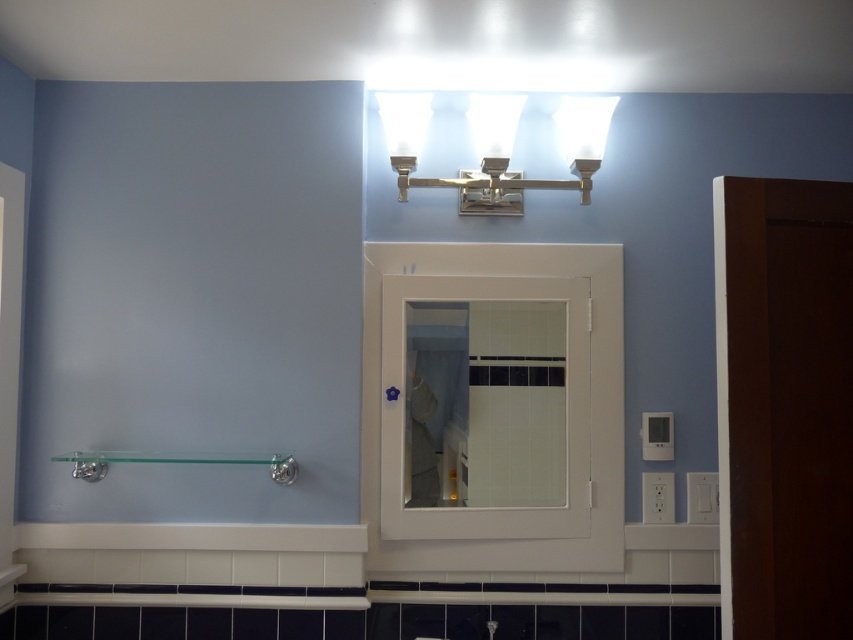
Question: Can you confirm if polished brass light fixture at upper center is positioned below matte silver faucet at lower center?

Choices:
 (A) yes
 (B) no

Answer: (B)

Question: Which of the following is the closest to the observer?

Choices:
 (A) (386, 128)
 (B) (94, 468)
 (C) (379, 545)

Answer: (A)

Question: Where is white matte medicine cabinet at center located in relation to clear glass mirror at center in the image?

Choices:
 (A) below
 (B) above

Answer: (A)

Question: Does polished brass light fixture at upper center appear on the left side of clear glass towel bar at lower center?

Choices:
 (A) yes
 (B) no

Answer: (B)

Question: Which object is the farthest from the polished brass light fixture at upper center?

Choices:
 (A) matte silver faucet at lower center
 (B) white matte medicine cabinet at center

Answer: (A)

Question: Among these objects, which one is farthest from the camera?

Choices:
 (A) white matte medicine cabinet at center
 (B) clear glass towel bar at lower center
 (C) matte silver faucet at lower center
 (D) polished brass light fixture at upper center

Answer: (A)